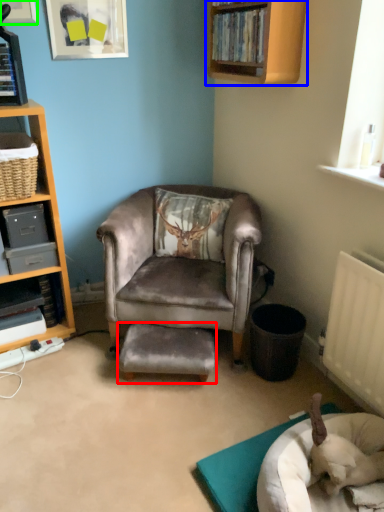
Question: Considering the real-world distances, which object is closest to stool (highlighted by a red box)? shelf (highlighted by a blue box) or shelf in the corner of a room with a picture frame on the wall (highlighted by a green box).

Choices:
 (A) shelf
 (B) shelf in the corner of a room with a picture frame on the wall

Answer: (A)